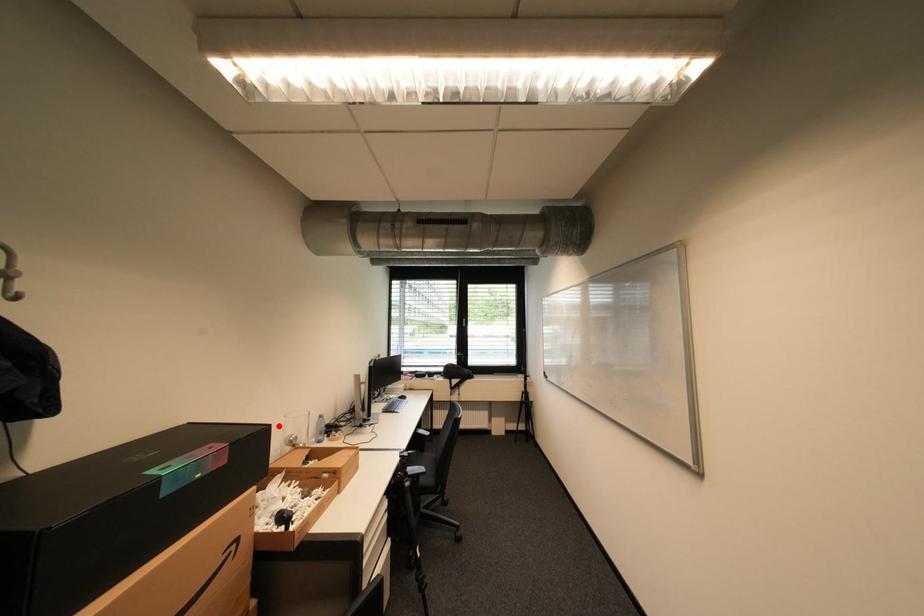
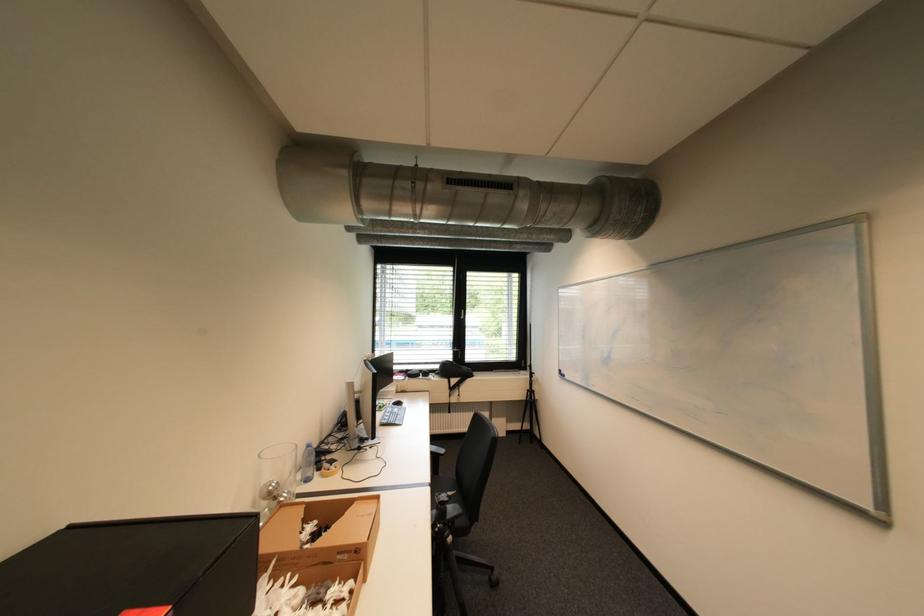
In the second image, find the point that corresponds to the highlighted location in the first image.

(265, 516)